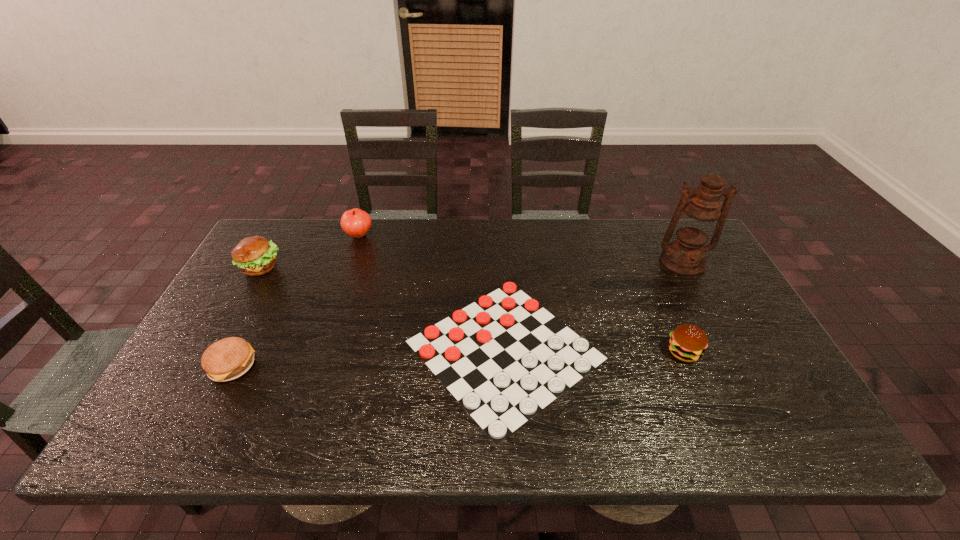
Identify the location of vacant space that is in between the farthest object and the second shortest object. The width and height of the screenshot is (960, 540). (296, 301).

Where is `free space between the tallest hamburger and the oil lamp`? Image resolution: width=960 pixels, height=540 pixels. free space between the tallest hamburger and the oil lamp is located at coordinates (471, 264).

This screenshot has width=960, height=540. What are the coordinates of `free area in between the apple and the shortest hamburger` in the screenshot? It's located at (296, 301).

What are the coordinates of `the second closest object relative to the fourth tallest object` in the screenshot? It's located at (696, 220).

The image size is (960, 540). I want to click on object that stands as the second closest to the tallest hamburger, so click(227, 359).

Find the location of `hamburger that stands as the closest to the shortest object`. hamburger that stands as the closest to the shortest object is located at coordinates (687, 342).

Where is `hamburger that is the second closest to the farthest object`? The height and width of the screenshot is (540, 960). hamburger that is the second closest to the farthest object is located at coordinates (227, 359).

Identify the location of free space in the image that satisfies the following two spatial constraints: 1. on the back side of the farthest object; 2. on the right side of the tallest hamburger. This screenshot has height=540, width=960. (278, 235).

Find the location of `vacant region that satisfies the following two spatial constraints: 1. on the back side of the oil lamp; 2. on the right side of the third object from right to left`. vacant region that satisfies the following two spatial constraints: 1. on the back side of the oil lamp; 2. on the right side of the third object from right to left is located at coordinates (500, 262).

Where is `free space that satisfies the following two spatial constraints: 1. on the back side of the tallest object; 2. on the right side of the checkerboard`? free space that satisfies the following two spatial constraints: 1. on the back side of the tallest object; 2. on the right side of the checkerboard is located at coordinates (500, 262).